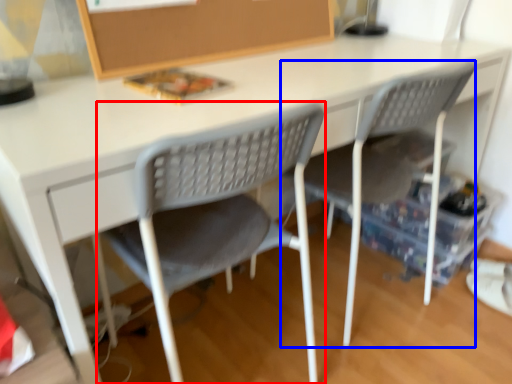
Question: Which point is closer to the camera, chair (highlighted by a red box) or chair (highlighted by a blue box)?

Choices:
 (A) chair
 (B) chair

Answer: (A)